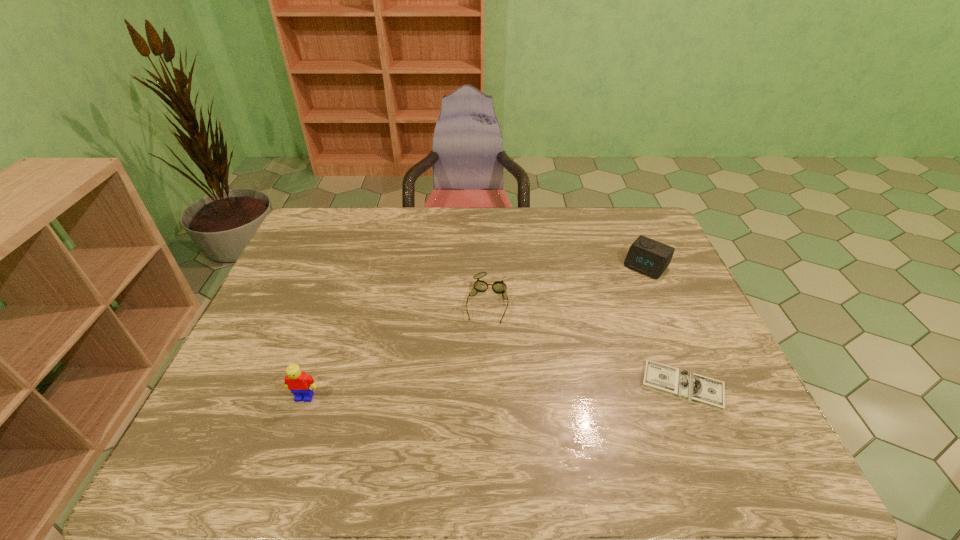
At what (x,y) coordinates should I click in order to perform the action: click on free space between the alarm clock and the shortest object. Please return your answer as a coordinate pair (x, y). This screenshot has height=540, width=960. Looking at the image, I should click on (664, 326).

Locate an element on the screen. The height and width of the screenshot is (540, 960). blank region between the alarm clock and the Lego is located at coordinates (475, 332).

Identify the location of free space between the tallest object and the spectacles. The height and width of the screenshot is (540, 960). (396, 349).

Locate an element on the screen. the second closest object to the alarm clock is located at coordinates (499, 287).

Locate an element on the screen. The width and height of the screenshot is (960, 540). object that is the third nearest to the shortest object is located at coordinates (300, 384).